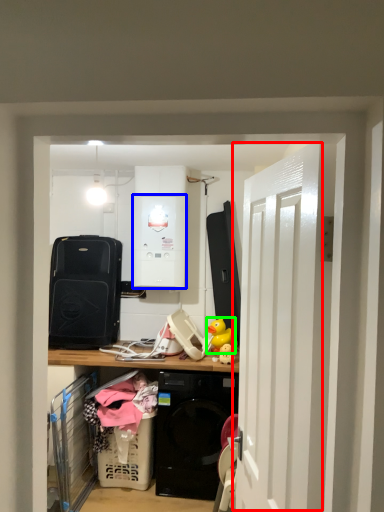
Question: Estimate the real-world distances between objects in this image. Which object is farther from door (highlighted by a red box), appliance (highlighted by a blue box) or toy (highlighted by a green box)?

Choices:
 (A) appliance
 (B) toy

Answer: (A)